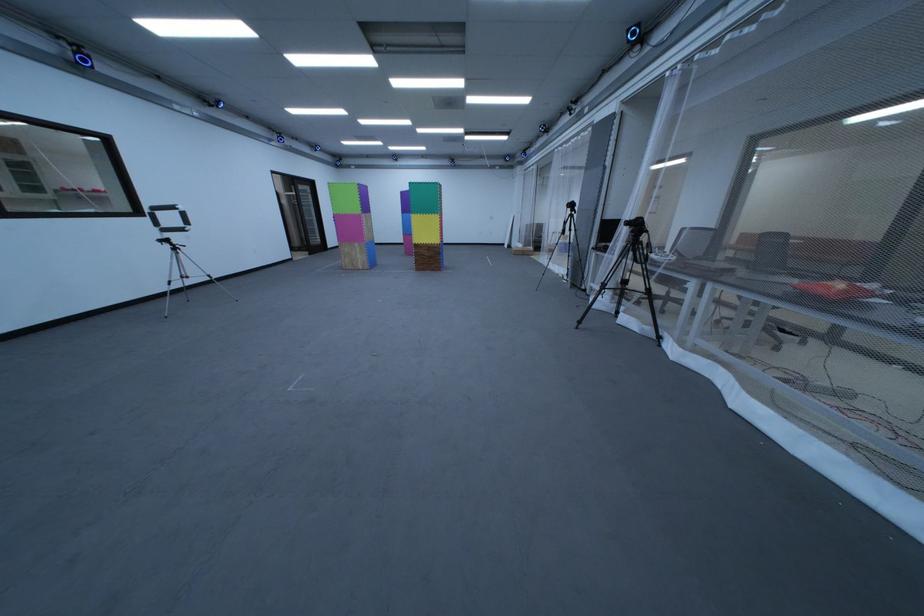
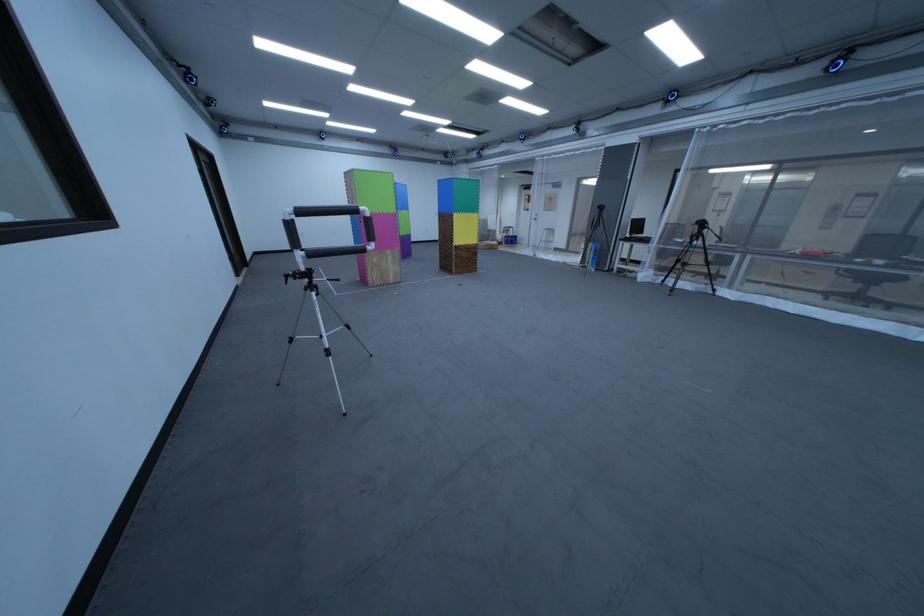
The point at (565, 246) is marked in the first image. Where is the corresponding point in the second image?

(517, 238)